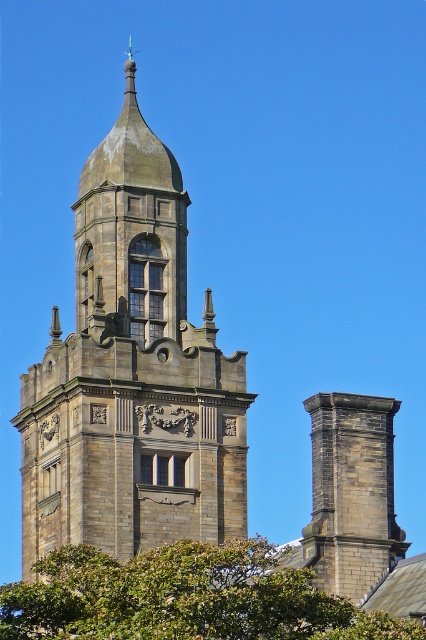
Consider the image. You are standing in front of the historic building and want to take a photo that includes both the stone tower at center and the green leafy tree at lower center. Which object should you frame first to ensure both are in the shot?

The stone tower at center is taller than the green leafy tree at lower center. To include both in the photo, you should frame the stone tower at center first since it is taller and occupies more vertical space, ensuring the shorter green leafy tree at lower center will fit within the frame.

You are a painter standing at the base of the stone tower at center, wanting to paint the green leafy tree at lower center. Can you see the entire tree without moving your position?

The stone tower at center might be wider than green leafy tree at lower center, so it could block your view of the entire tree depending on their exact dimensions.